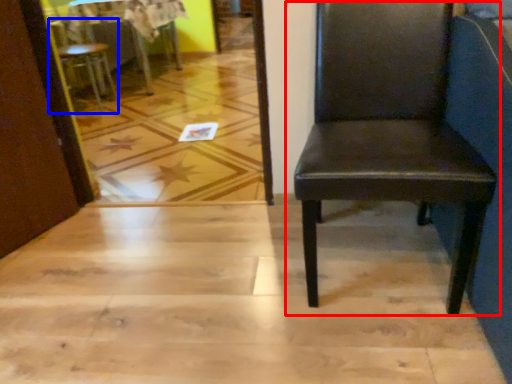
Question: Among these objects, which one is farthest to the camera, chair (highlighted by a red box) or chair (highlighted by a blue box)?

Choices:
 (A) chair
 (B) chair

Answer: (B)